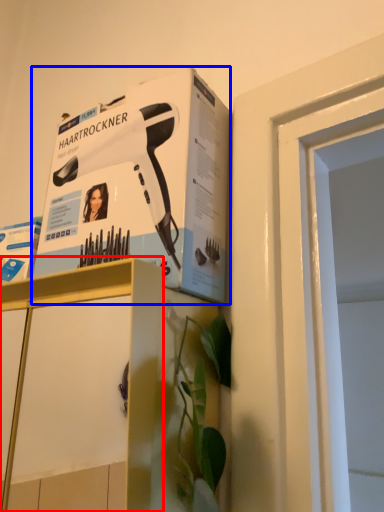
Question: Among these objects, which one is farthest to the camera, cabinetry (highlighted by a red box) or paperback book (highlighted by a blue box)?

Choices:
 (A) cabinetry
 (B) paperback book

Answer: (B)